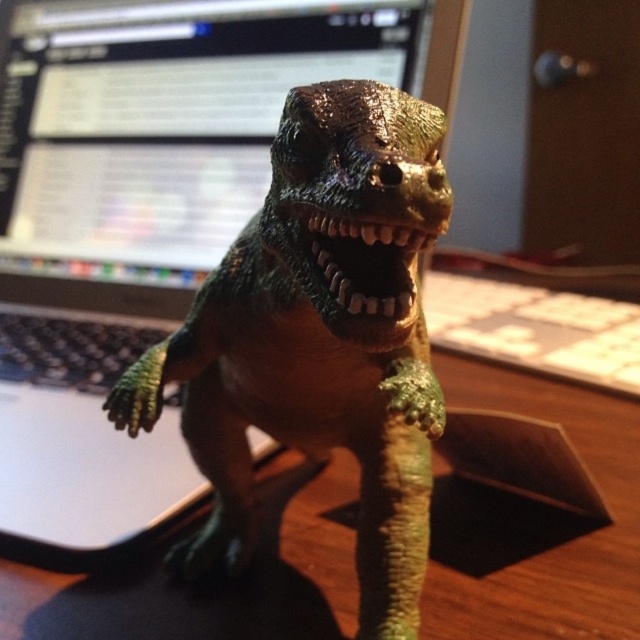
Question: Can you confirm if wooden desk at center is wider than matte black monitor at upper center?

Choices:
 (A) yes
 (B) no

Answer: (A)

Question: Which point appears farthest from the camera in this image?

Choices:
 (A) (353, 182)
 (B) (22, 301)

Answer: (B)

Question: Which is nearer to the wooden desk at center?

Choices:
 (A) shiny plastic dinosaur at center
 (B) matte black monitor at upper center

Answer: (A)

Question: Does wooden desk at center have a greater width compared to matte black monitor at upper center?

Choices:
 (A) yes
 (B) no

Answer: (A)

Question: Which is farther from the wooden desk at center?

Choices:
 (A) shiny plastic dinosaur at center
 (B) matte black monitor at upper center

Answer: (B)

Question: From the image, what is the correct spatial relationship of shiny plastic dinosaur at center in relation to wooden desk at center?

Choices:
 (A) above
 (B) below

Answer: (A)